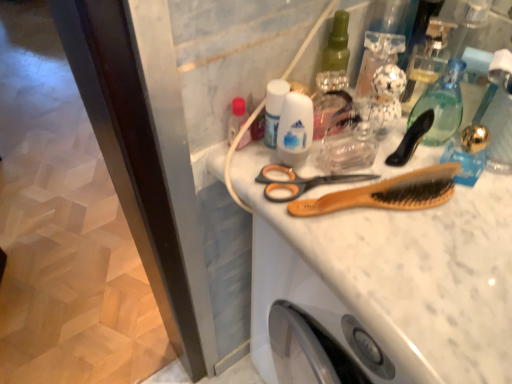
Identify the location of free spot in front of translucent glass mouthwash at upper right, the first mouthwash in the right-to-left sequence. The width and height of the screenshot is (512, 384). (435, 237).